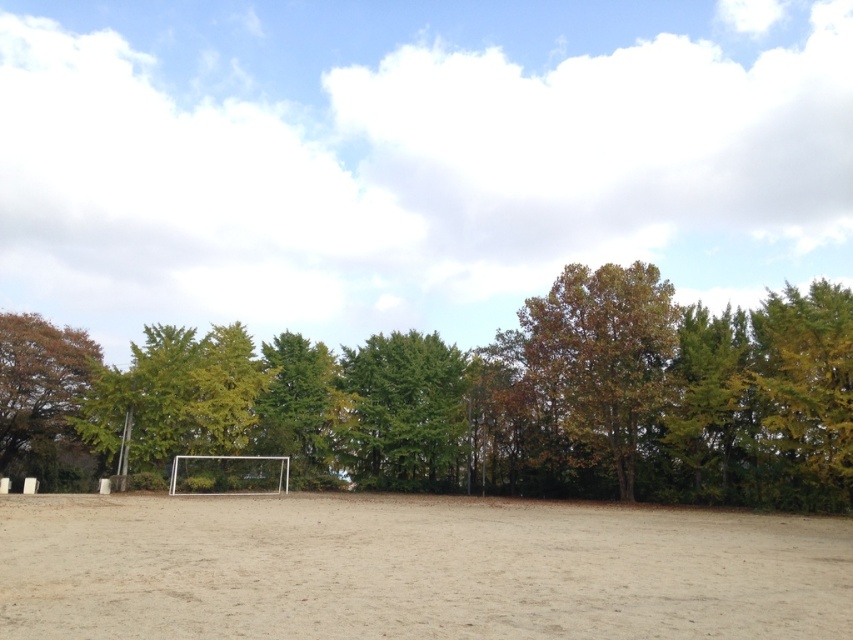
Question: Is brown/leathery tree at right above green leafy tree at center?

Choices:
 (A) no
 (B) yes

Answer: (B)

Question: Which object is the farthest from the brown leafy tree at center?

Choices:
 (A) brown/leathery tree at right
 (B) green leafy tree at center
 (C) brown leafy tree at left
 (D) brown sandy ground at center

Answer: (D)

Question: Which object is the closest to the green leafy tree at center?

Choices:
 (A) brown leafy tree at left
 (B) brown leafy tree at center
 (C) brown/leathery tree at right
 (D) brown sandy ground at center

Answer: (B)

Question: Is brown/leathery tree at right to the right of green leafy tree at center from the viewer's perspective?

Choices:
 (A) no
 (B) yes

Answer: (B)

Question: Which of the following is the farthest from the observer?

Choices:
 (A) brown leafy tree at left
 (B) green leafy tree at center

Answer: (B)

Question: Is brown leafy tree at center behind brown sandy ground at center?

Choices:
 (A) yes
 (B) no

Answer: (A)